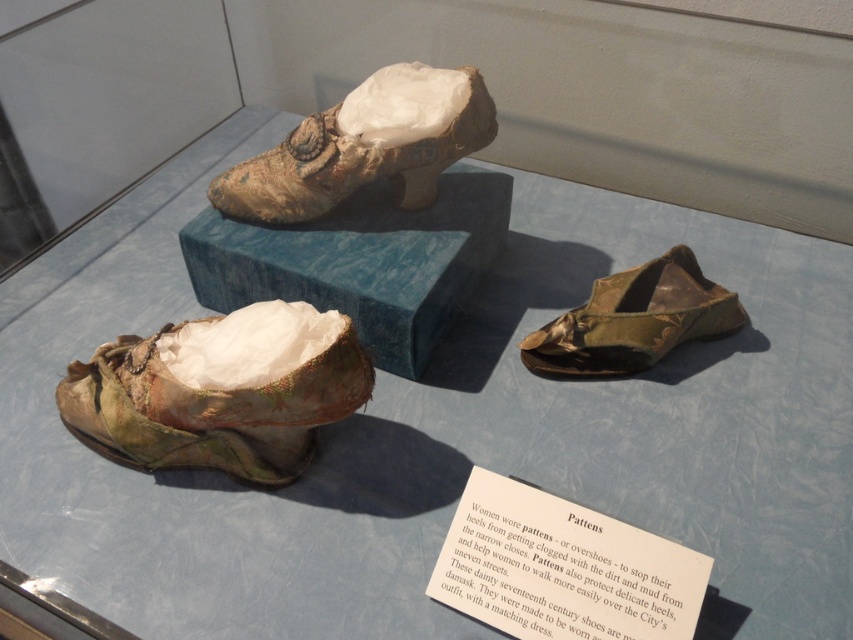
What are the coordinates of `green satin shoe at lower left` in the screenshot? It's located at (209, 410).

Does point (61, 390) come behind point (490, 124)?

No, (61, 390) is closer to viewer.

Is point (161, 380) closer to camera compared to point (306, 216)?

Yes, it is.

Locate an element on the screen. The height and width of the screenshot is (640, 853). green satin shoe at lower left is located at coordinates pyautogui.click(x=209, y=410).

The height and width of the screenshot is (640, 853). Find the location of `matte gold fabric shoe at upper center`. matte gold fabric shoe at upper center is located at coordinates (347, 163).

Can you confirm if matte gold fabric shoe at upper center is shorter than green fabric shoe at lower right?

Incorrect, matte gold fabric shoe at upper center's height does not fall short of green fabric shoe at lower right's.

Is point (427, 180) in front of point (674, 284)?

Yes, it is.

Locate an element on the screen. The height and width of the screenshot is (640, 853). matte gold fabric shoe at upper center is located at coordinates (347, 163).

Looking at this image, can you confirm if green satin shoe at lower left is smaller than green fabric shoe at lower right?

No, green satin shoe at lower left is not smaller than green fabric shoe at lower right.

Between point (259, 444) and point (717, 317), which one is positioned behind?

Point (717, 317)

You are a GUI agent. You are given a task and a screenshot of the screen. Output one action in this format:
    pyautogui.click(x=<x>, y=<y>)
    Task: Click on the green satin shoe at lower left
    The height and width of the screenshot is (640, 853).
    Given the screenshot: What is the action you would take?
    pyautogui.click(x=209, y=410)

At what (x,y) coordinates should I click in order to perform the action: click on green satin shoe at lower left. Please return your answer as a coordinate pair (x, y). This screenshot has width=853, height=640. Looking at the image, I should click on (209, 410).